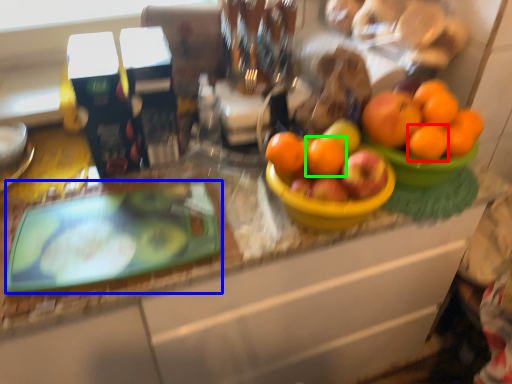
Question: Based on their relative distances, which object is nearer to orange (highlighted by a red box)? Choose from glass plate (highlighted by a blue box) and orange (highlighted by a green box).

Choices:
 (A) glass plate
 (B) orange

Answer: (B)